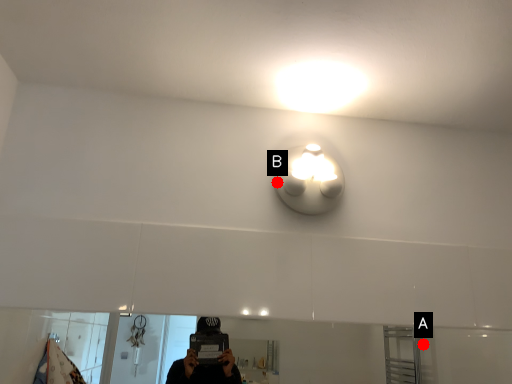
Question: Two points are circled on the image, labeled by A and B beside each circle. Which of the following is the closest to the observer?

Choices:
 (A) A is closer
 (B) B is closer

Answer: (B)